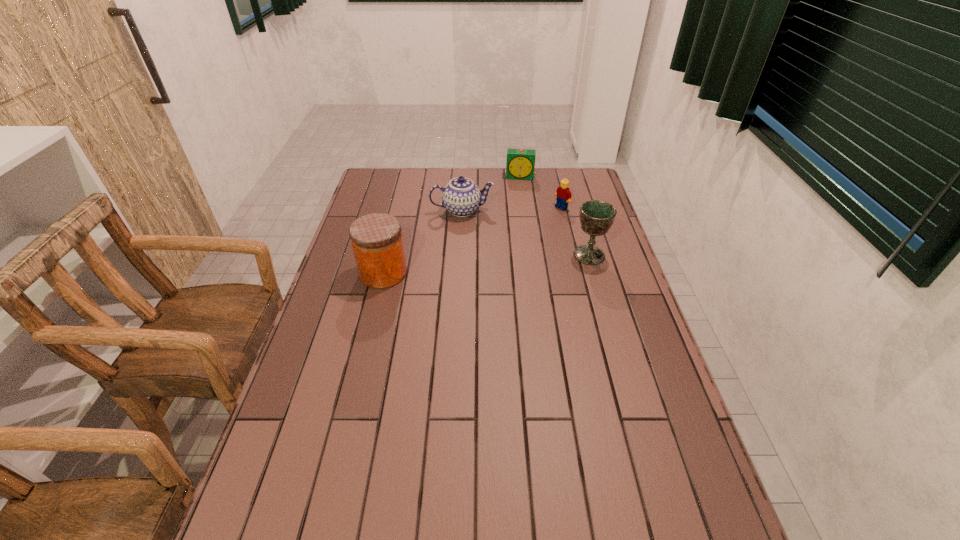
Locate an element on the screen. The width and height of the screenshot is (960, 540). free spot on the desktop that is between the leftmost object and the chalice and is positioned on the front-facing side of the third object from left to right is located at coordinates (514, 262).

Where is `vacant space on the desktop that is between the leftmost object and the chalice and is positioned on the front-facing side of the Lego`? This screenshot has height=540, width=960. vacant space on the desktop that is between the leftmost object and the chalice and is positioned on the front-facing side of the Lego is located at coordinates (468, 266).

The height and width of the screenshot is (540, 960). Identify the location of free space on the desktop that is between the jar and the chalice and is positioned at the spout of the third tallest object. (468, 266).